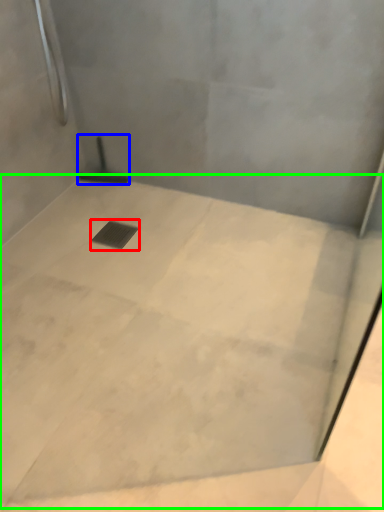
Question: Which is farther away from drain (highlighted by a red box)? shower (highlighted by a blue box) or concrete (highlighted by a green box)?

Choices:
 (A) shower
 (B) concrete

Answer: (B)